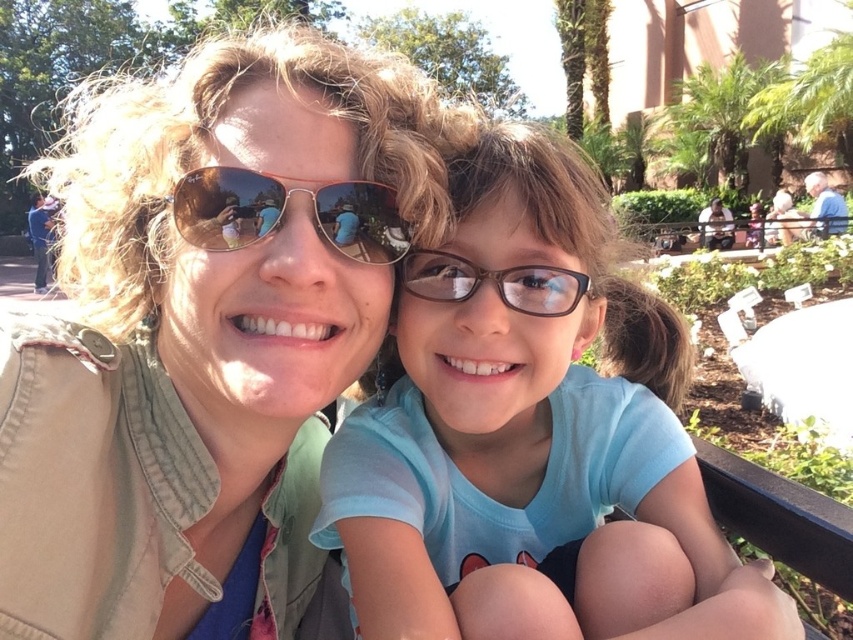
Question: Which of the following is the farthest from the observer?

Choices:
 (A) (534, 301)
 (B) (135, 333)
 (C) (393, 257)
 (D) (405, 516)

Answer: (B)

Question: Considering the real-world distances, which object is farthest from the light blue fabric shirt at center?

Choices:
 (A) matte khaki jacket at center
 (B) gold reflective sunglasses at center

Answer: (B)

Question: Which point is closer to the camera?

Choices:
 (A) (577, 291)
 (B) (287, 278)
 (C) (344, 234)
 (D) (685, 496)

Answer: (B)

Question: Does light blue fabric shirt at center appear over gold reflective sunglasses at center?

Choices:
 (A) no
 (B) yes

Answer: (A)

Question: Does light blue fabric shirt at center appear over brown plastic glasses at center?

Choices:
 (A) no
 (B) yes

Answer: (A)

Question: Does matte khaki jacket at center have a lesser width compared to brown plastic glasses at center?

Choices:
 (A) yes
 (B) no

Answer: (B)